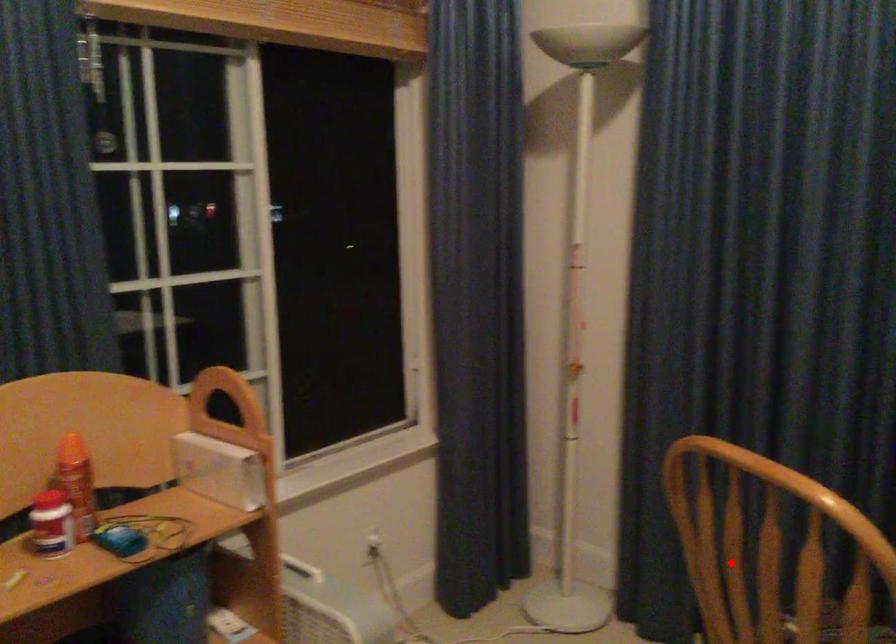
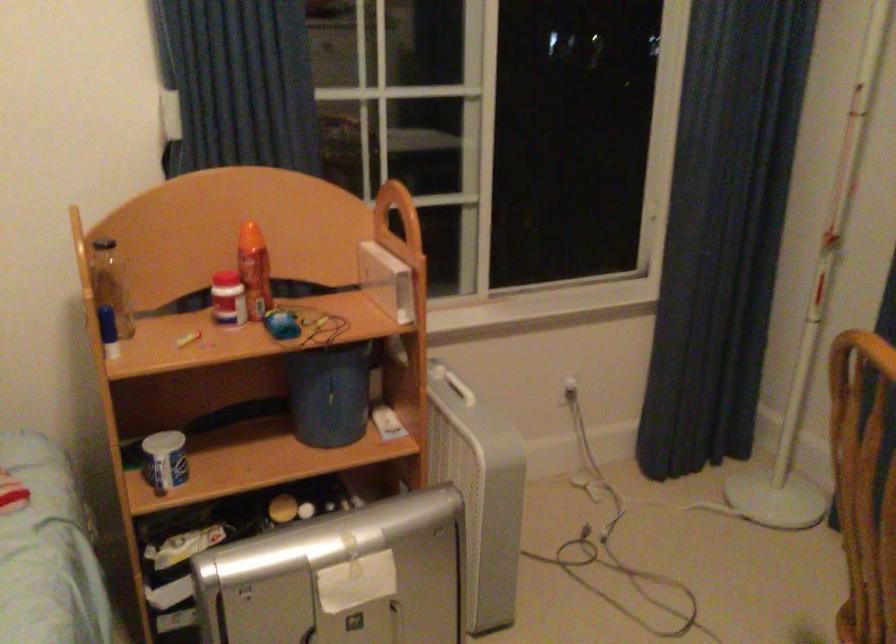
Locate, in the second image, the point that corresponds to the highlighted location in the first image.

(864, 484)